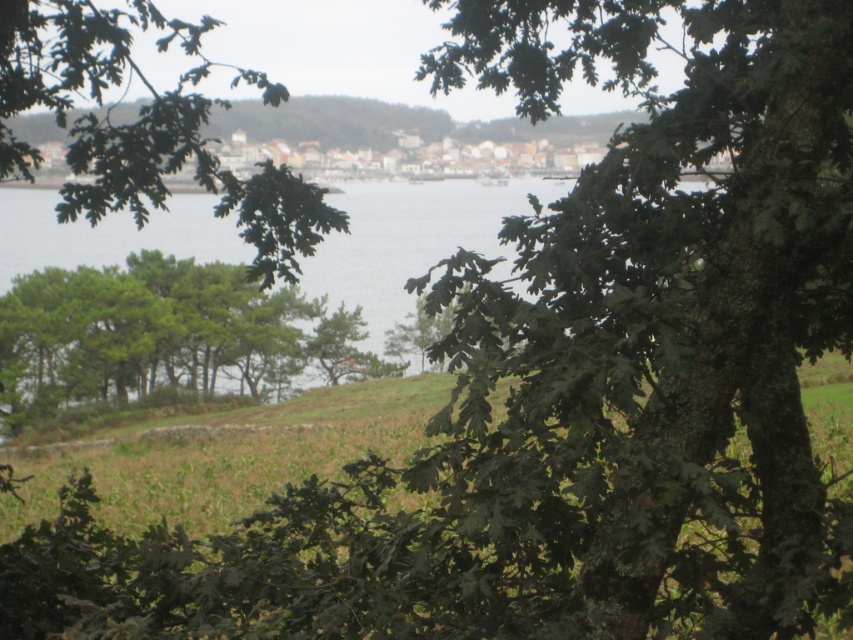
You are planning to build a small garden path between the green leafy tree at center and the green water at center. Given that the path needs to be at least 2 meters wide to accommodate a wheelbarrow, can the space between them support this requirement?

The green leafy tree at center is narrower than the green water at center. However, the exact width of the space between them isn not specified in the provided description. Without specific measurements, it is impossible to determine if the path will be wide enough for a wheelbarrow.

You are a bird flying over the landscape and want to land on the green leafy tree at center or the green water at center. Which location is above the other?

The green leafy tree at center is positioned over the green water at center, so the tree is above the water.

You are a hiker trying to determine the best spot to set up your tent. You notice a green leafy tree at center and green water at center. Which object is taller and would provide better shade?

The green leafy tree at center is taller than the green water at center, so it would provide better shade for setting up your tent.